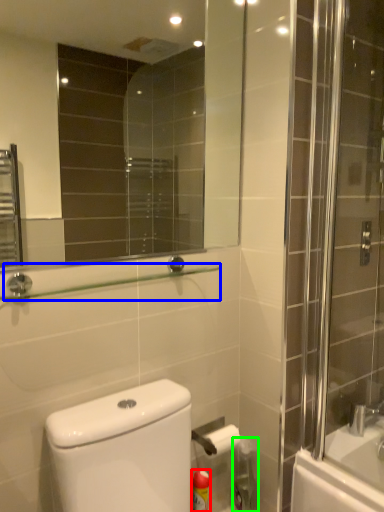
Question: Which object is positioned farthest from cleaning product (highlighted by a red box)? Select from balustrade (highlighted by a blue box) and cleaning product (highlighted by a green box).

Choices:
 (A) balustrade
 (B) cleaning product

Answer: (A)